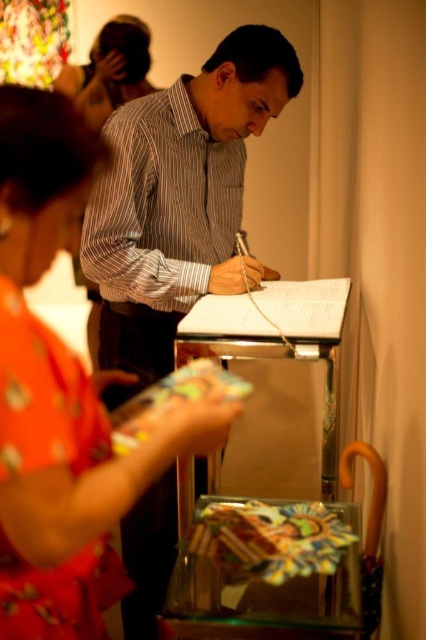
You are a photographer at a social event. You see the floral fabric dress at lower left and a camera. If you want to take a photo of the dress, can you reach the camera without moving your body?

The floral fabric dress at lower left and camera are 24.10 inches apart from each other, so yes, you can reach the camera without moving your body since the distance is manageable.

You are a photographer at this event and want to capture a photo of both the striped shirt at center and the matte black hair at upper left in the same frame. Given their positions, which object should you focus on first to ensure both are in focus?

The striped shirt at center is taller than matte black hair at upper left. To ensure both are in focus, you should focus on the striped shirt at center first since it is taller and likely farther away, allowing the depth of field to cover the closer matte black hair at upper left.

You are at a social event and notice two striped shirts in the scene. Which one is the striped shirt at center closer to you compared to the striped cotton shirt at center?

The striped shirt at center is closer to the viewer than the striped cotton shirt at center.